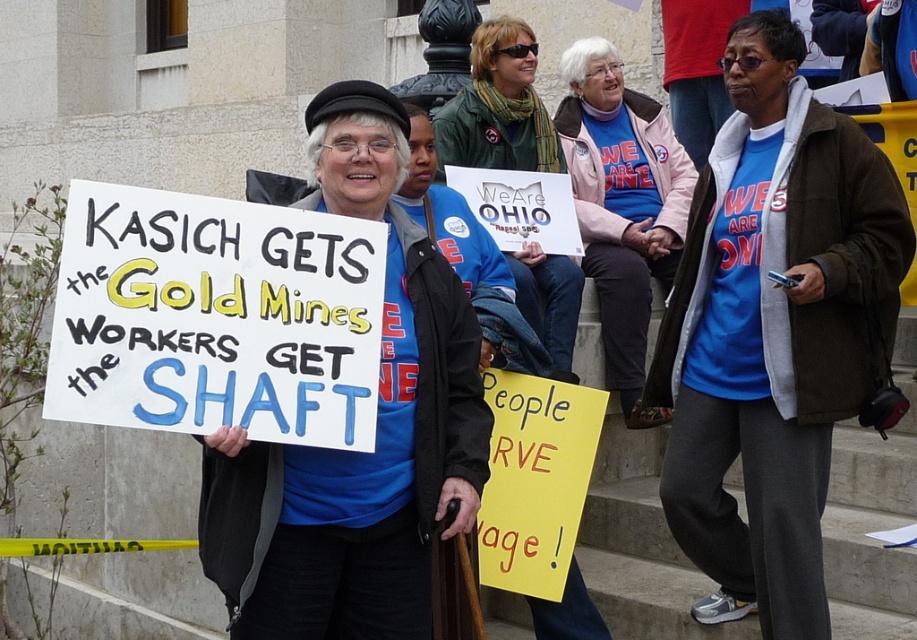
Question: Is blue cotton shirt at center wider than green scarf at center?

Choices:
 (A) yes
 (B) no

Answer: (A)

Question: Which of the following is the closest to the observer?

Choices:
 (A) (820, 518)
 (B) (531, 93)

Answer: (A)

Question: Can you confirm if blue t-shirt at center is thinner than green scarf at center?

Choices:
 (A) yes
 (B) no

Answer: (B)

Question: Does matte blue shirt at center appear over blue cotton shirt at center?

Choices:
 (A) yes
 (B) no

Answer: (B)

Question: Which point is closer to the camera taking this photo?

Choices:
 (A) (848, 362)
 (B) (570, 371)

Answer: (A)

Question: Which of these objects is positioned closest to the matte blue shirt at center?

Choices:
 (A) green scarf at center
 (B) blue t-shirt at center
 (C) blue cotton shirt at center

Answer: (A)